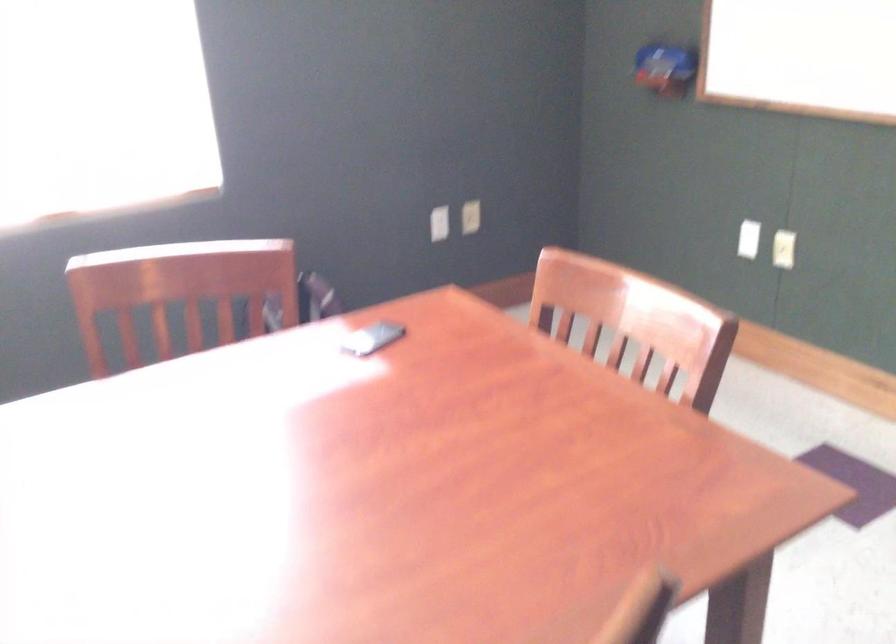
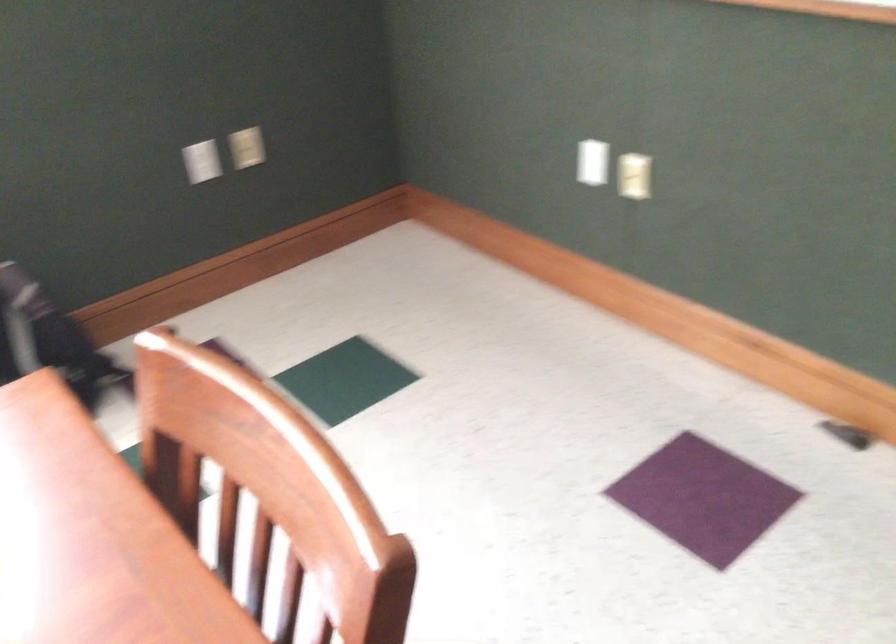
Question: The first image is from the beginning of the video and the second image is from the end. How did the camera likely rotate when shooting the video?

Choices:
 (A) Left
 (B) Right
 (C) Up
 (D) Down

Answer: (D)